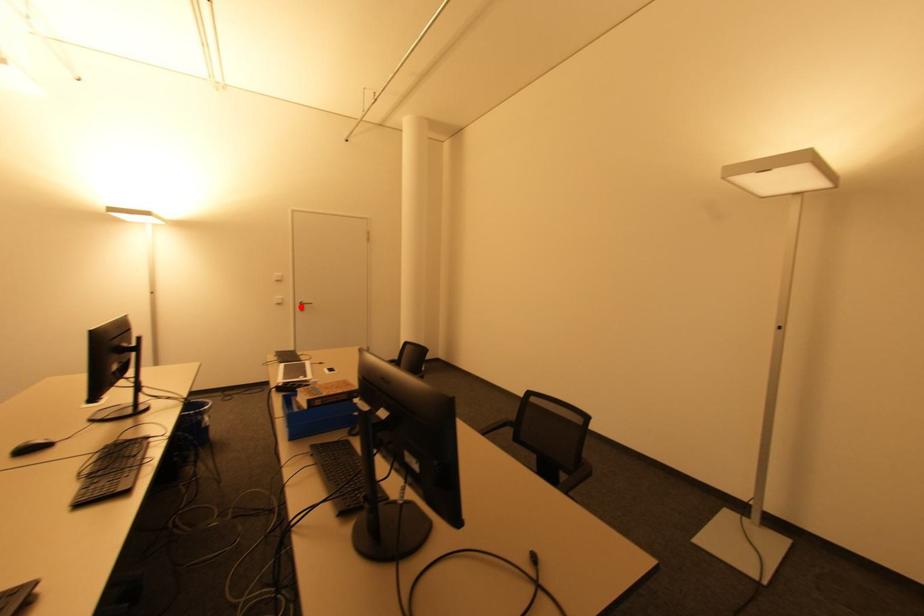
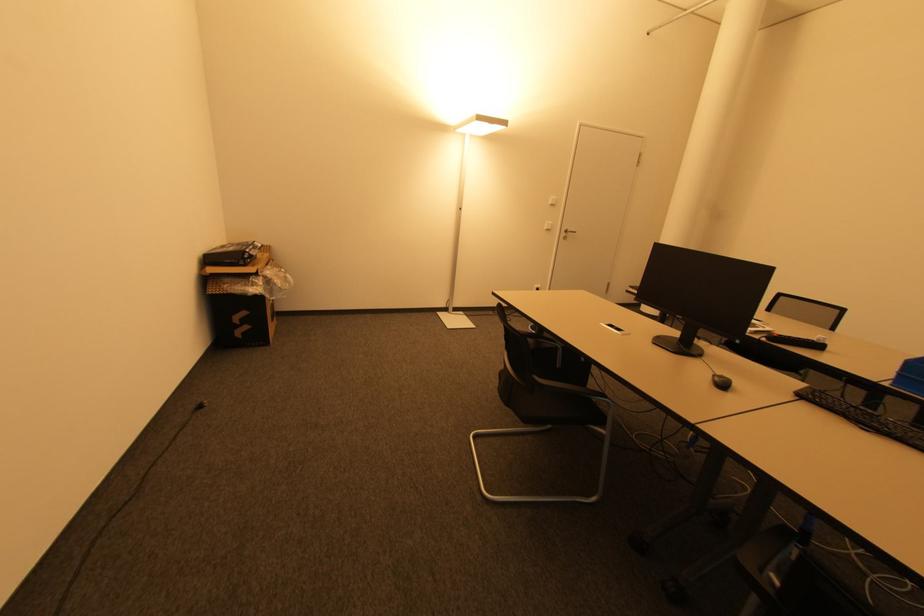
Question: I am providing you with two images of the same scene from different viewpoints. Given a red point in image1, look at the same physical point in image2. Is it:

Choices:
 (A) Closer to the viewpoint
 (B) Farther from the viewpoint

Answer: (A)